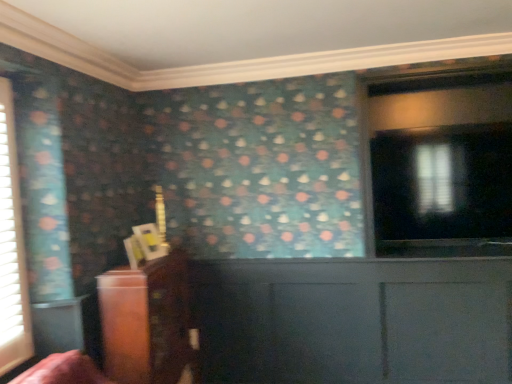
Where is `white textured blinds at left`? The height and width of the screenshot is (384, 512). white textured blinds at left is located at coordinates (12, 247).

Considering the relative sizes of transparent glass window at upper right and wooden cabinet at left in the image provided, is transparent glass window at upper right wider than wooden cabinet at left?

No, transparent glass window at upper right is not wider than wooden cabinet at left.

Which of these two, transparent glass window at upper right or wooden cabinet at left, is bigger?

Bigger between the two is wooden cabinet at left.

From the image's perspective, between transparent glass window at upper right and wooden cabinet at left, which one is located above?

transparent glass window at upper right is shown above in the image.

Between white textured blinds at left and transparent glass window at upper right, which one has more height?

white textured blinds at left is taller.

Considering the relative positions of white textured blinds at left and transparent glass window at upper right in the image provided, is white textured blinds at left to the left of transparent glass window at upper right from the viewer's perspective?

Correct, you'll find white textured blinds at left to the left of transparent glass window at upper right.

Which is in front, point (9, 86) or point (437, 204)?

The point (9, 86) is closer to the camera.

Looking at their sizes, would you say white textured blinds at left is wider or thinner than transparent glass window at upper right?

Considering their sizes, white textured blinds at left looks slimmer than transparent glass window at upper right.

Which object is wider, white textured blinds at left or wooden cabinet at left?

wooden cabinet at left is wider.

Does point (6, 355) come farther from viewer compared to point (166, 292)?

No.

From the image's perspective, which one is positioned lower, white textured blinds at left or wooden cabinet at left?

wooden cabinet at left is shown below in the image.

Are white textured blinds at left and wooden cabinet at left beside each other?

No, white textured blinds at left is not in contact with wooden cabinet at left.

Is wooden cabinet at left situated inside transparent glass window at upper right or outside?

wooden cabinet at left exists outside the volume of transparent glass window at upper right.

From the image's perspective, is wooden cabinet at left positioned above or below transparent glass window at upper right?

Based on their image positions, wooden cabinet at left is located beneath transparent glass window at upper right.

Which point is more forward, (148, 270) or (461, 235)?

The point (148, 270) is more forward.

Considering the relative positions of wooden cabinet at left and transparent glass window at upper right in the image provided, is wooden cabinet at left to the right of transparent glass window at upper right from the viewer's perspective?

No.

Can you tell me how much transparent glass window at upper right and white textured blinds at left differ in facing direction?

The angular difference between transparent glass window at upper right and white textured blinds at left is 93.4 degrees.

Considering the relative sizes of transparent glass window at upper right and white textured blinds at left in the image provided, is transparent glass window at upper right taller than white textured blinds at left?

No.

From the image's perspective, does transparent glass window at upper right appear lower than white textured blinds at left?

No, from the image's perspective, transparent glass window at upper right is not below white textured blinds at left.

Do you think transparent glass window at upper right is within white textured blinds at left, or outside of it?

transparent glass window at upper right is spatially situated outside white textured blinds at left.

Who is shorter, wooden cabinet at left or white textured blinds at left?

Standing shorter between the two is wooden cabinet at left.

From the image's perspective, between wooden cabinet at left and white textured blinds at left, who is located below?

wooden cabinet at left, from the image's perspective.

Looking at the image, does wooden cabinet at left seem bigger or smaller compared to white textured blinds at left?

In the image, wooden cabinet at left appears to be larger than white textured blinds at left.

Is point (139, 289) positioned after point (7, 279)?

Yes, it is.

Locate an element on the screen. window screen that is above the wooden cabinet at left (from a real-world perspective) is located at coordinates (443, 183).

This screenshot has height=384, width=512. I want to click on window below the transparent glass window at upper right (from the image's perspective), so click(x=12, y=247).

Which object lies further to the anchor point transparent glass window at upper right, white textured blinds at left or wooden cabinet at left?

white textured blinds at left lies further to transparent glass window at upper right than the other object.

Considering their positions, is transparent glass window at upper right positioned closer to white textured blinds at left than wooden cabinet at left?

wooden cabinet at left is closer to white textured blinds at left.

Which object lies further to the anchor point wooden cabinet at left, transparent glass window at upper right or white textured blinds at left?

Among the two, transparent glass window at upper right is located further to wooden cabinet at left.

Estimate the real-world distances between objects in this image. Which object is further from wooden cabinet at left, white textured blinds at left or transparent glass window at upper right?

The object further to wooden cabinet at left is transparent glass window at upper right.

Estimate the real-world distances between objects in this image. Which object is further from transparent glass window at upper right, wooden cabinet at left or white textured blinds at left?

white textured blinds at left.

When comparing their distances from white textured blinds at left, does wooden cabinet at left or transparent glass window at upper right seem closer?

wooden cabinet at left is closer to white textured blinds at left.

The image size is (512, 384). I want to click on furniture between white textured blinds at left and transparent glass window at upper right from left to right, so click(x=146, y=321).